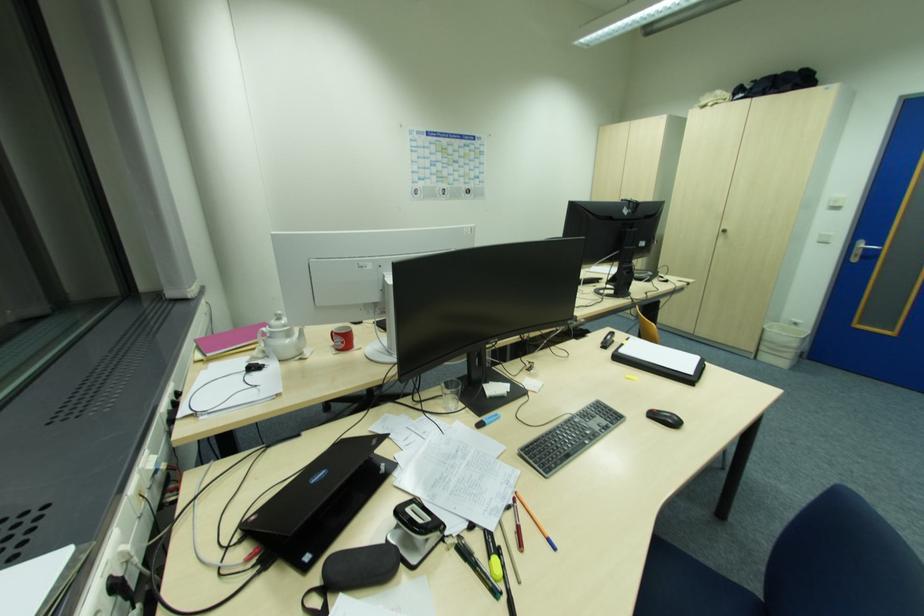
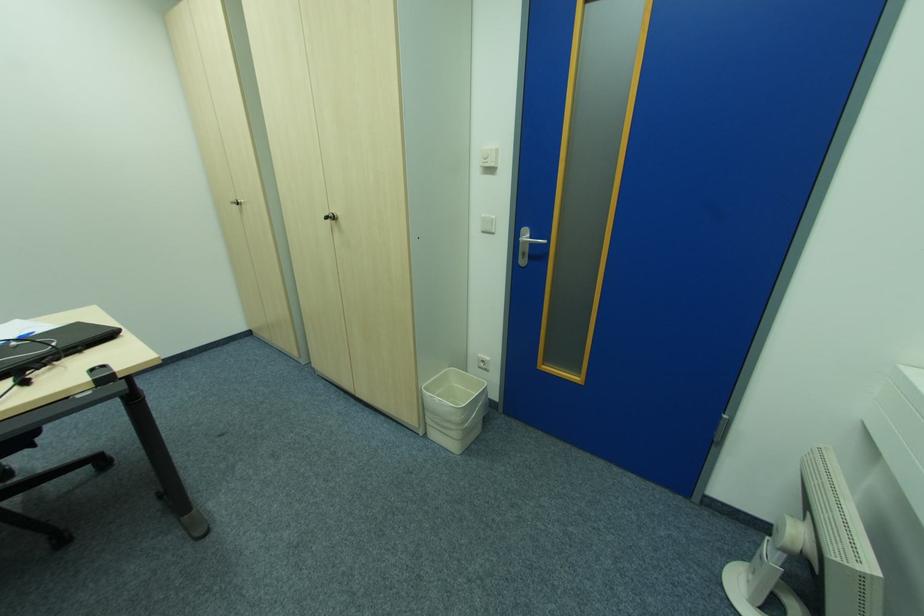
Locate, in the second image, the point that corresponds to the point at 726,232 in the first image.

(334, 219)